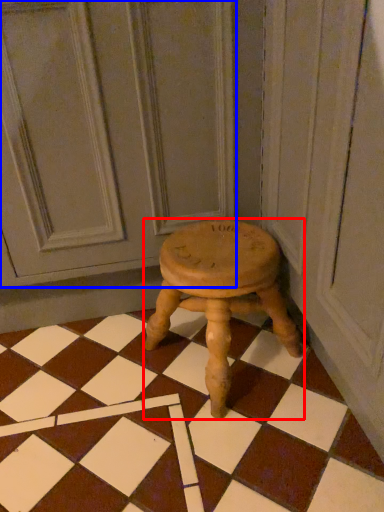
Question: Which of the following is the closest to the observer, stool (highlighted by a red box) or screen door (highlighted by a blue box)?

Choices:
 (A) stool
 (B) screen door

Answer: (B)